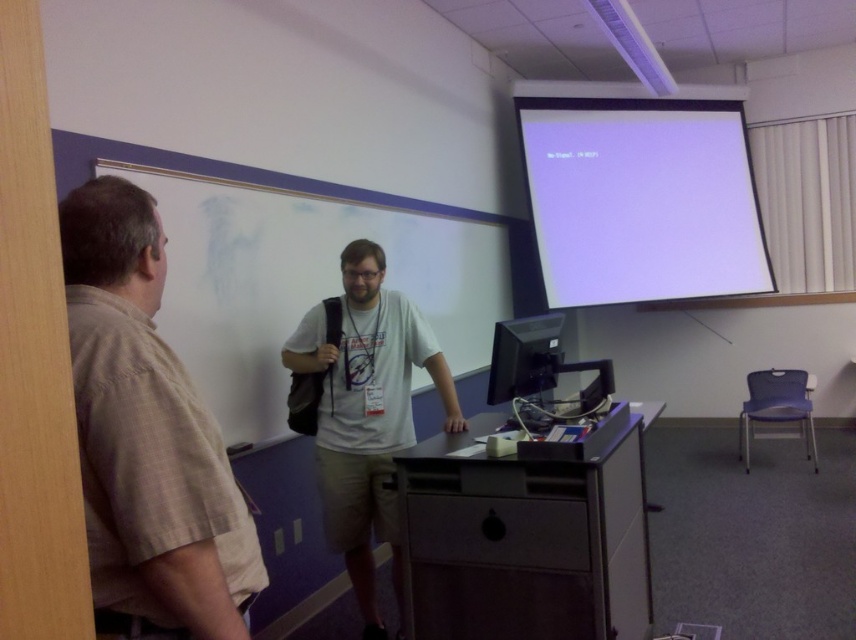
Can you confirm if beige cotton shirt at left is shorter than white cotton t-shirt at center?

Correct, beige cotton shirt at left is not as tall as white cotton t-shirt at center.

Between point (195, 481) and point (418, 362), which one is positioned in front?

Point (195, 481) is more forward.

Locate an element on the screen. The height and width of the screenshot is (640, 856). beige cotton shirt at left is located at coordinates (147, 436).

Is white matte projection screen at upper right positioned in front of matte black monitor at center?

No, white matte projection screen at upper right is behind matte black monitor at center.

Who is more forward, (654, 140) or (516, 394)?

Positioned in front is point (516, 394).

At what (x,y) coordinates should I click in order to perform the action: click on white matte projection screen at upper right. Please return your answer as a coordinate pair (x, y). Image resolution: width=856 pixels, height=640 pixels. Looking at the image, I should click on (642, 198).

In the scene shown: Is white cotton t-shirt at center above matte black monitor at center?

Incorrect, white cotton t-shirt at center is not positioned above matte black monitor at center.

Is white cotton t-shirt at center positioned in front of matte black monitor at center?

That is False.

Between point (337, 476) and point (539, 356), which one is positioned in front?

Point (539, 356) is in front.

Find the location of a particular element. white cotton t-shirt at center is located at coordinates (367, 413).